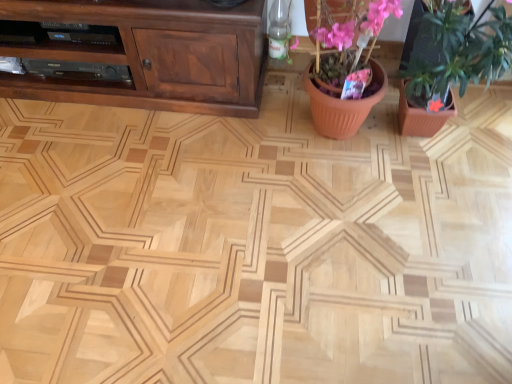
Question: Do you think brown wood cabinet at upper left is within terracotta pot at center, or outside of it?

Choices:
 (A) inside
 (B) outside

Answer: (B)

Question: From the image's perspective, relative to terracotta pot at center, is brown wood cabinet at upper left above or below?

Choices:
 (A) below
 (B) above

Answer: (B)

Question: Which object is the closest to the pink matte flower pot at upper right?

Choices:
 (A) terracotta pot at center
 (B) brown wood cabinet at upper left

Answer: (A)

Question: Which is nearer to the terracotta pot at center?

Choices:
 (A) pink matte flower pot at upper right
 (B) brown wood cabinet at upper left

Answer: (A)